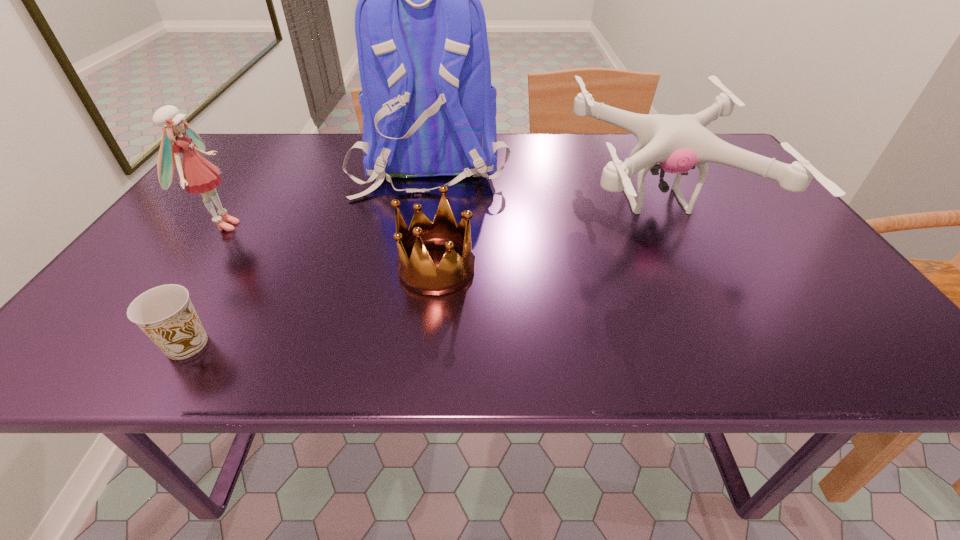
Locate an element on the screen. This screenshot has width=960, height=540. free spot between the doll and the crown is located at coordinates (329, 247).

The width and height of the screenshot is (960, 540). Identify the location of free space that is in between the fourth shortest object and the crown. (329, 247).

Where is `free spot between the nearest object and the backpack`? The image size is (960, 540). free spot between the nearest object and the backpack is located at coordinates (309, 254).

Find the location of a particular element. This screenshot has height=540, width=960. free spot between the backpack and the nearest object is located at coordinates (309, 254).

Find the location of a particular element. This screenshot has height=540, width=960. free spot between the second tallest object and the crown is located at coordinates (329, 247).

Where is `vacant space that is in between the tallest object and the rightmost object`? Image resolution: width=960 pixels, height=540 pixels. vacant space that is in between the tallest object and the rightmost object is located at coordinates (543, 183).

Identify which object is the third nearest to the Dixie cup. Please provide its 2D coordinates. Your answer should be formatted as a tuple, i.e. [(x, y)], where the tuple contains the x and y coordinates of a point satisfying the conditions above.

[(428, 107)]

Select which object appears as the third closest to the nearest object. Please provide its 2D coordinates. Your answer should be formatted as a tuple, i.e. [(x, y)], where the tuple contains the x and y coordinates of a point satisfying the conditions above.

[(428, 107)]

Where is `free spot that satisfies the following two spatial constraints: 1. on the front-facing side of the doll; 2. on the back side of the Dixie cup`? free spot that satisfies the following two spatial constraints: 1. on the front-facing side of the doll; 2. on the back side of the Dixie cup is located at coordinates (138, 345).

Find the location of a particular element. This screenshot has height=540, width=960. blank area in the image that satisfies the following two spatial constraints: 1. on the front-facing side of the doll; 2. on the left side of the Dixie cup is located at coordinates (138, 345).